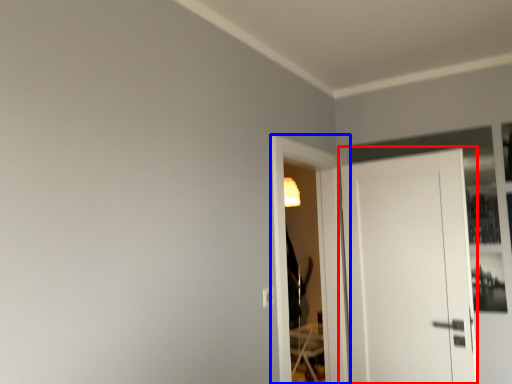
Question: Which point is further to the camera, door (highlighted by a red box) or screen door (highlighted by a blue box)?

Choices:
 (A) door
 (B) screen door

Answer: (A)